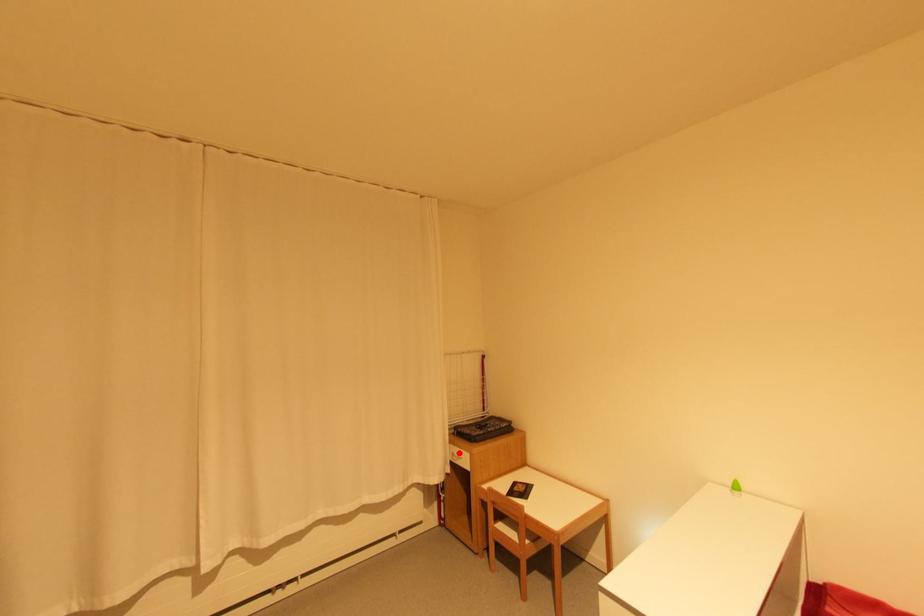
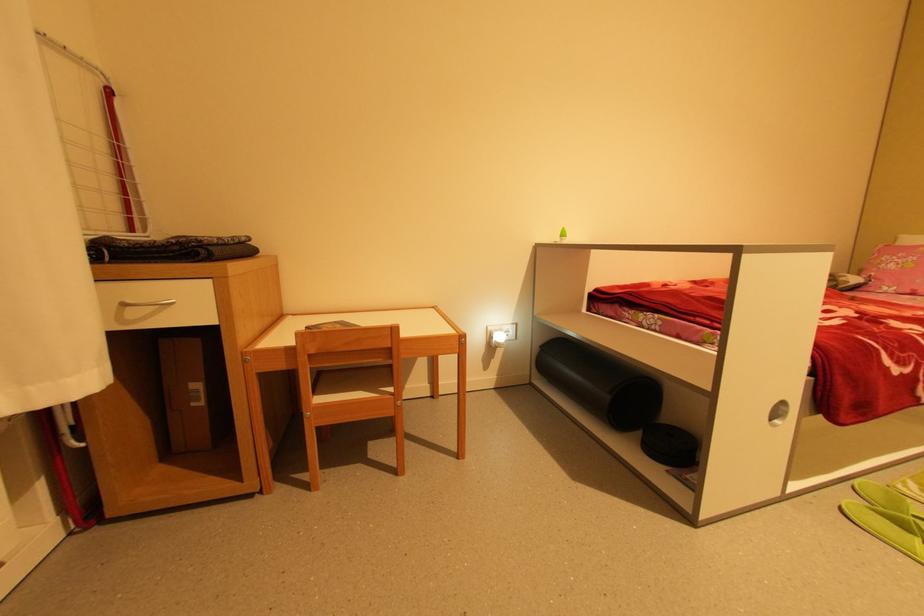
The point at the highlighted location is marked in the first image. Where is the corresponding point in the second image?

(134, 302)